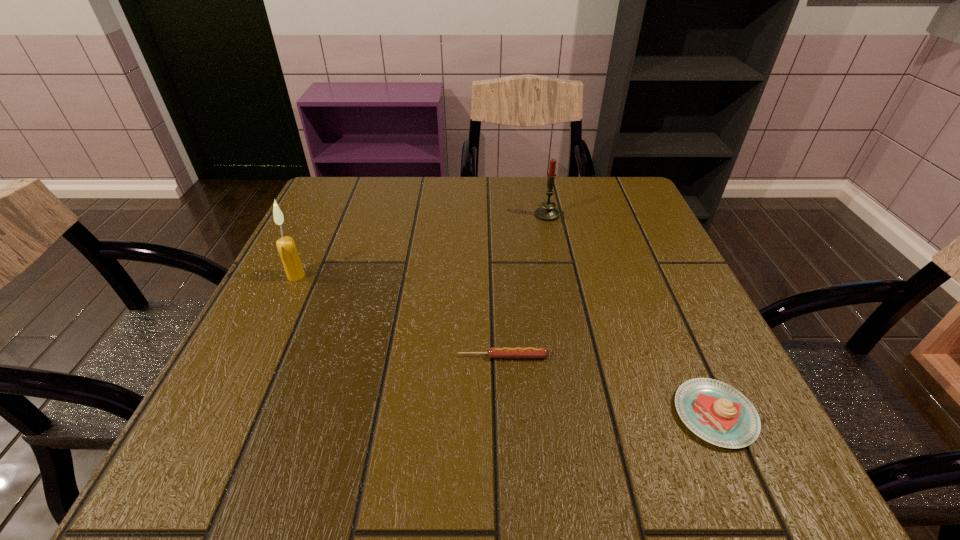
Locate an element on the screen. The width and height of the screenshot is (960, 540). vacant space at the far left corner is located at coordinates (347, 199).

Image resolution: width=960 pixels, height=540 pixels. Find the location of `vacant space at the near left corner`. vacant space at the near left corner is located at coordinates (244, 424).

In the image, there is a desktop. Identify the location of free space at the far right corner. (617, 214).

The width and height of the screenshot is (960, 540). Identify the location of vacant space at the near right corner. (773, 461).

The image size is (960, 540). I want to click on empty location between the second object from left to right and the second object from right to left, so click(525, 286).

This screenshot has width=960, height=540. Identify the location of free space between the tallest object and the farther candle. (421, 245).

In order to click on empty location between the nearer candle and the shorter candle in this screenshot , I will do `click(421, 245)`.

Identify the location of empty space that is in between the second object from right to left and the third tallest object. This screenshot has width=960, height=540. (631, 315).

Where is `vacant space that's between the left candle and the second shortest object`? The image size is (960, 540). vacant space that's between the left candle and the second shortest object is located at coordinates (506, 345).

Locate an element on the screen. The width and height of the screenshot is (960, 540). free space between the right candle and the third tallest object is located at coordinates [x=631, y=315].